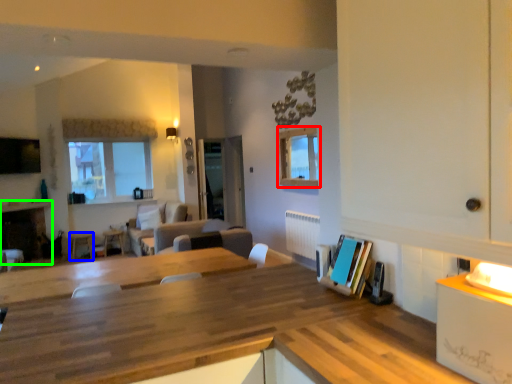
Question: Considering the real-world distances, which object is farthest from window (highlighted by a red box)? chair (highlighted by a blue box) or fireplace (highlighted by a green box)?

Choices:
 (A) chair
 (B) fireplace

Answer: (B)